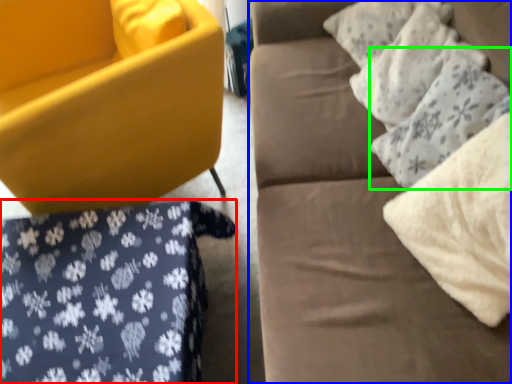
Question: Which object is positioned closest to bedding (highlighted by a red box)? Select from studio couch (highlighted by a blue box) and pillow (highlighted by a green box).

Choices:
 (A) studio couch
 (B) pillow

Answer: (A)